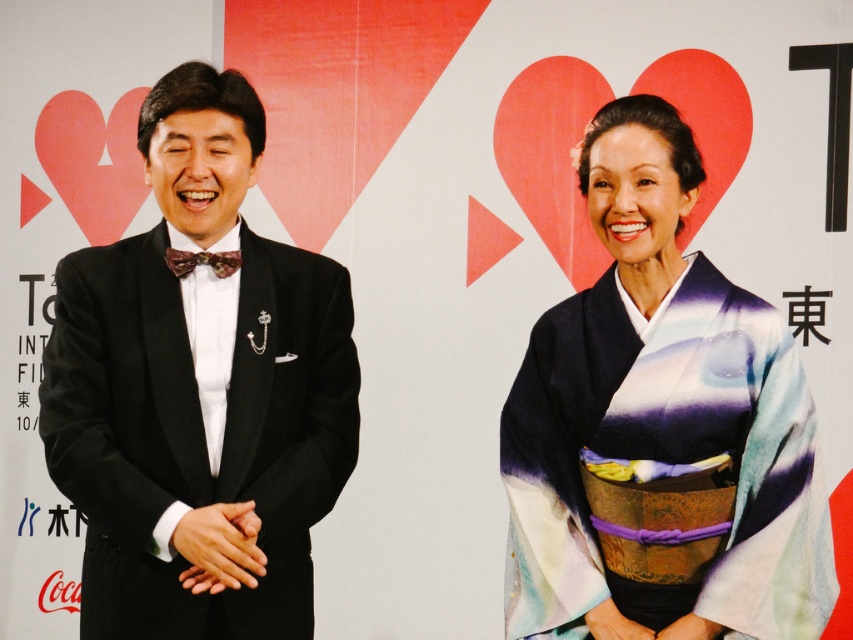
Question: Does silky kimono at right have a larger size compared to shiny purple bow tie at center?

Choices:
 (A) no
 (B) yes

Answer: (B)

Question: Is the position of black satin tuxedo at left less distant than that of shiny purple bow tie at center?

Choices:
 (A) no
 (B) yes

Answer: (B)

Question: Which of the following is the closest to the observer?

Choices:
 (A) (181, 272)
 (B) (271, 260)
 (C) (728, 531)

Answer: (C)

Question: Which object is positioned farthest from the silky kimono at right?

Choices:
 (A) black satin tuxedo at left
 (B) shiny purple bow tie at center

Answer: (B)

Question: From the image, what is the correct spatial relationship of black satin tuxedo at left in relation to silky kimono at right?

Choices:
 (A) left
 (B) right

Answer: (A)

Question: Among these points, which one is farthest from the camera?

Choices:
 (A) (654, 548)
 (B) (187, 272)

Answer: (B)